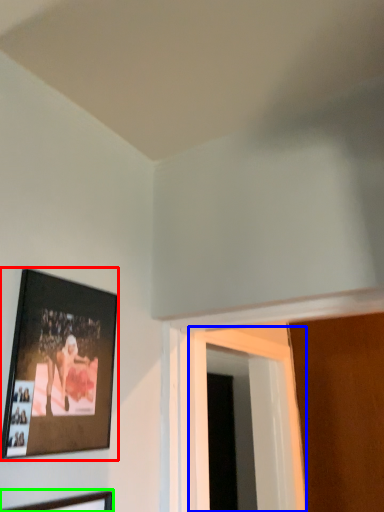
Question: Which is farther away from picture frame (highlighted by a red box)? window (highlighted by a blue box) or picture frame (highlighted by a green box)?

Choices:
 (A) window
 (B) picture frame

Answer: (A)